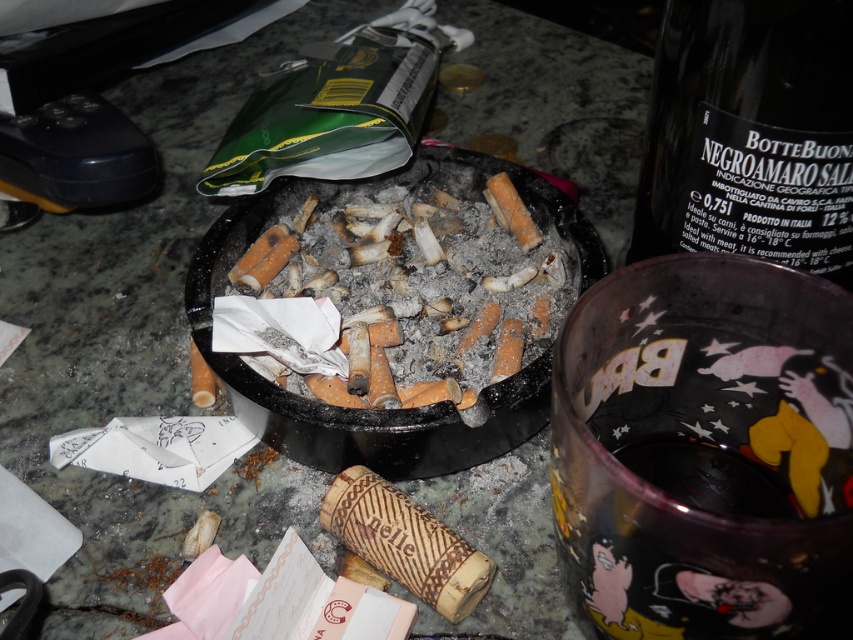
Does dark green glass bottle at upper right have a lesser width compared to charcoal ash at center?

Yes.

Is point (738, 209) in front of point (283, 228)?

That is True.

Where is `dark green glass bottle at upper right`? This screenshot has height=640, width=853. dark green glass bottle at upper right is located at coordinates (750, 132).